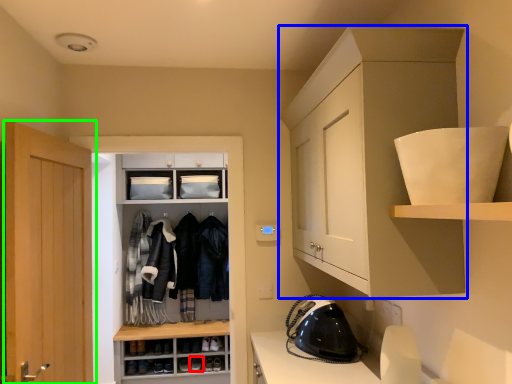
Question: Based on their relative distances, which object is farther from footwear (highlighted by a red box)? Choose from cabinetry (highlighted by a blue box) and door (highlighted by a green box).

Choices:
 (A) cabinetry
 (B) door

Answer: (A)